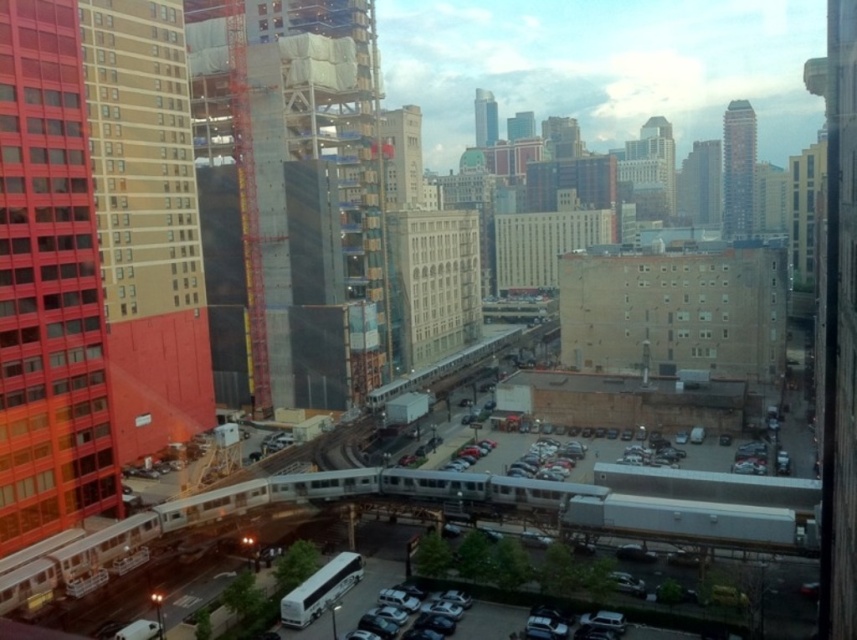
Is the position of tan smooth building at center-left more distant than that of metallic silver car at lower center?

Yes, tan smooth building at center-left is further from the viewer.

Can you confirm if tan smooth building at center-left is positioned above metallic silver car at lower center?

Indeed, tan smooth building at center-left is positioned over metallic silver car at lower center.

At what (x,y) coordinates should I click in order to perform the action: click on tan smooth building at center-left. Please return your answer as a coordinate pair (x, y). This screenshot has height=640, width=857. Looking at the image, I should click on (141, 156).

The width and height of the screenshot is (857, 640). I want to click on tan smooth building at center-left, so click(x=141, y=156).

Is smooth glass windows at left further to the viewer compared to metallic silver car at lower center?

Yes, smooth glass windows at left is further from the viewer.

Is smooth glass windows at left wider than metallic silver car at lower center?

No.

Is point (82, 486) positioned after point (452, 600)?

Yes, point (82, 486) is farther from viewer.

This screenshot has height=640, width=857. What are the coordinates of `smooth glass windows at left` in the screenshot? It's located at (48, 285).

Which of these two, smooth glass windows at left or tan smooth building at center-left, stands shorter?

tan smooth building at center-left is shorter.

Between smooth glass windows at left and tan smooth building at center-left, which one is positioned lower?

smooth glass windows at left is below.

Describe the element at coordinates (48, 285) in the screenshot. I see `smooth glass windows at left` at that location.

Locate an element on the screen. smooth glass windows at left is located at coordinates (48, 285).